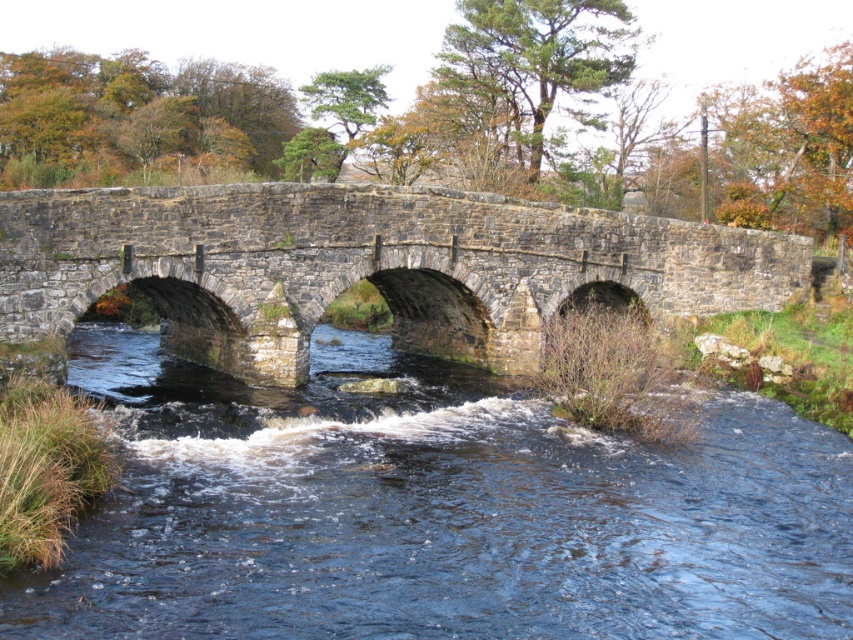
Is point (532, 474) more distant than point (222, 320)?

No, (532, 474) is closer to viewer.

Between dark blue water at center and stone bridge at center, which one is positioned lower?

Positioned lower is dark blue water at center.

Between point (808, 433) and point (48, 227), which one is positioned in front?

Positioned in front is point (48, 227).

Find the location of a particular element. This screenshot has height=640, width=853. dark blue water at center is located at coordinates (434, 513).